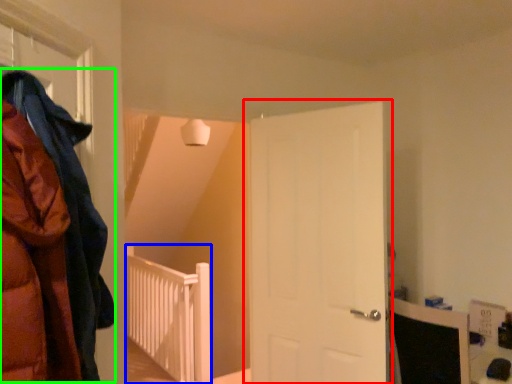
Question: Which object is the closest to the door (highlighted by a red box)? Choose among these: rail (highlighted by a blue box) or cloak (highlighted by a green box).

Choices:
 (A) rail
 (B) cloak

Answer: (B)